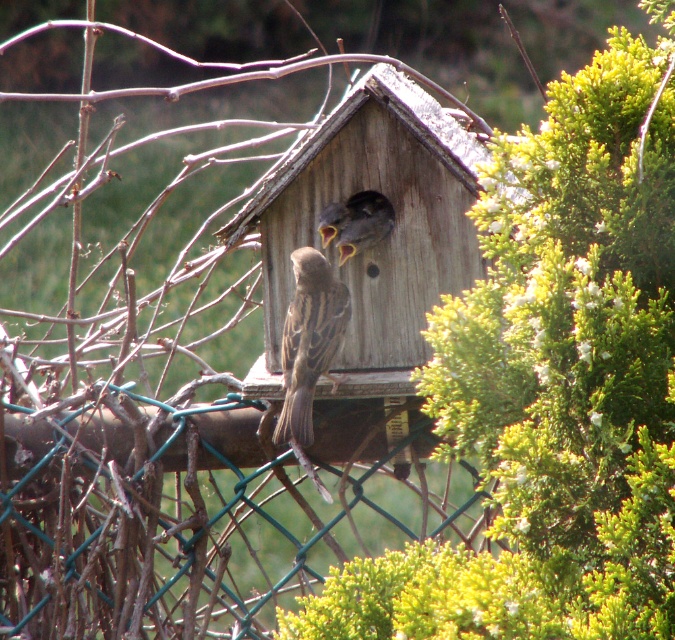
Question: Which of the following is the closest to the observer?

Choices:
 (A) green wire mesh at center
 (B) brown matte bird at center
 (C) green leafy bush at upper right

Answer: (C)

Question: Does green wire mesh at center appear on the right side of brown matte bird at center?

Choices:
 (A) no
 (B) yes

Answer: (A)

Question: Does green leafy bush at upper right come behind brown matte sparrow at center?

Choices:
 (A) yes
 (B) no

Answer: (B)

Question: Which of these objects is positioned closest to the green wire mesh at center?

Choices:
 (A) green leafy bush at upper right
 (B) brown matte bird at center
 (C) brown matte sparrow at center

Answer: (C)

Question: Where is green leafy bush at upper right located in relation to brown matte bird at center in the image?

Choices:
 (A) left
 (B) right

Answer: (B)

Question: Which point is closer to the camera taking this photo?

Choices:
 (A) (648, 264)
 (B) (313, 333)

Answer: (A)